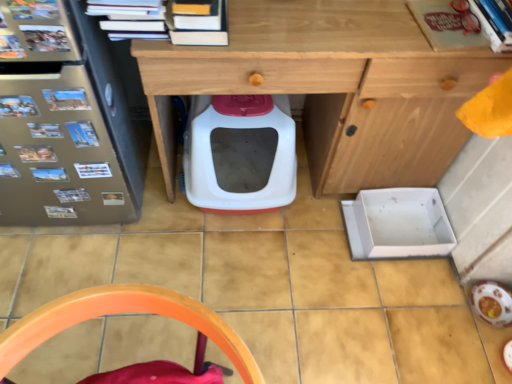
Find the location of `vacant space underneath matte red book at upper right, which appears as the 2th book when viewed from the left (from a real-world perspective)`. vacant space underneath matte red book at upper right, which appears as the 2th book when viewed from the left (from a real-world perspective) is located at coordinates (444, 36).